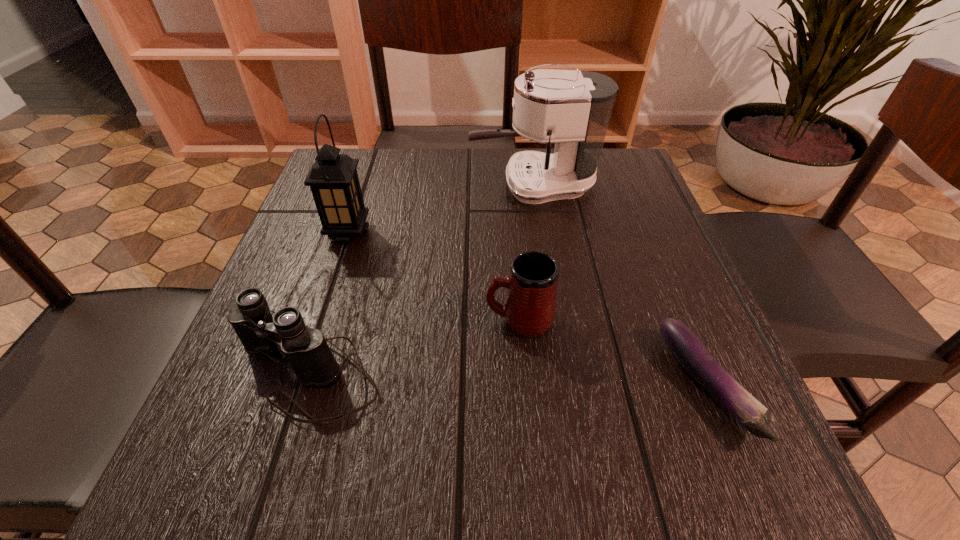
The image size is (960, 540). Find the location of `vacant space that satisfies the following two spatial constraints: 1. on the front-facing side of the coffee maker; 2. on the back side of the rightmost object`. vacant space that satisfies the following two spatial constraints: 1. on the front-facing side of the coffee maker; 2. on the back side of the rightmost object is located at coordinates (564, 386).

Locate an element on the screen. free space in the image that satisfies the following two spatial constraints: 1. on the front-facing side of the coffee maker; 2. on the back side of the rightmost object is located at coordinates (564, 386).

The image size is (960, 540). In order to click on free spot that satisfies the following two spatial constraints: 1. on the front side of the binoculars; 2. on the right side of the lantern in this screenshot , I will do `click(301, 373)`.